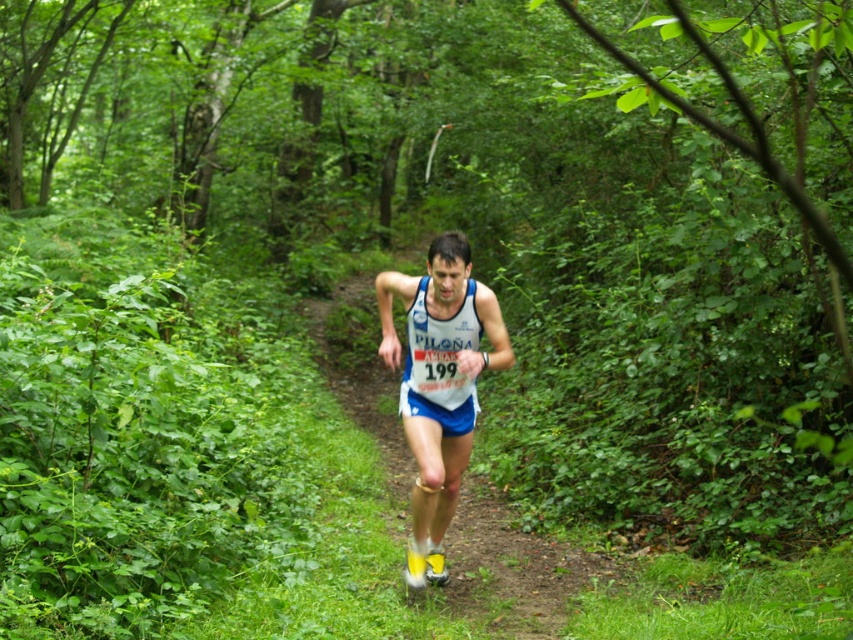
Is blue fabric runner at center to the left of white fabric runner at center from the viewer's perspective?

Yes, blue fabric runner at center is to the left of white fabric runner at center.

Can you confirm if blue fabric runner at center is smaller than white fabric runner at center?

No.

Which is behind, point (392, 440) or point (392, 337)?

The point (392, 440) is more distant.

This screenshot has width=853, height=640. I want to click on blue fabric runner at center, so click(x=512, y=570).